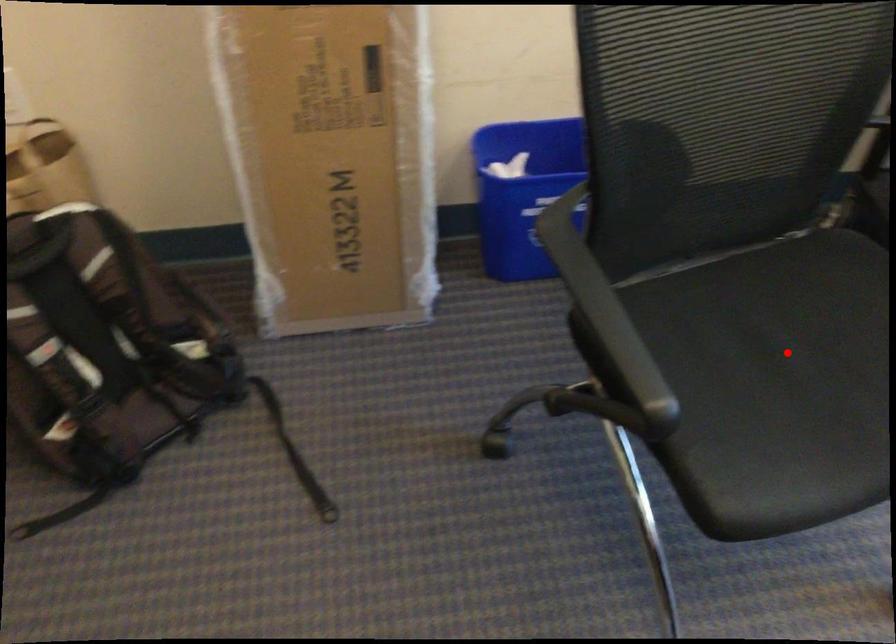
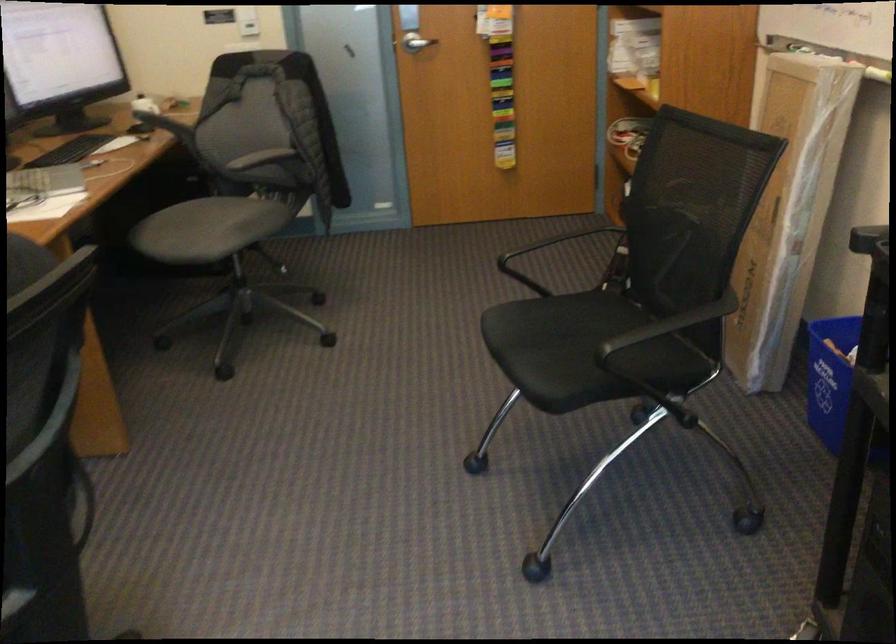
The point at the highlighted location is marked in the first image. Where is the corresponding point in the second image?

(583, 351)